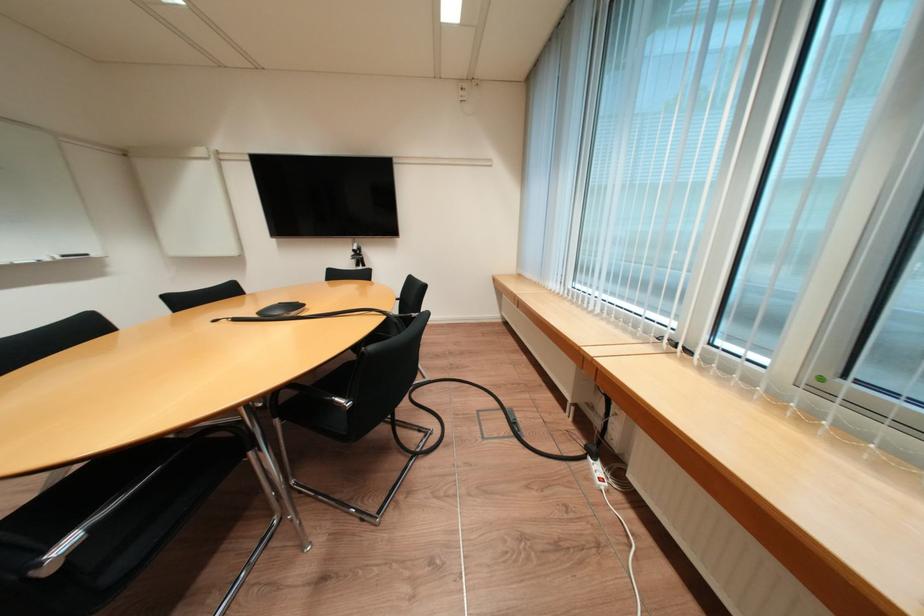
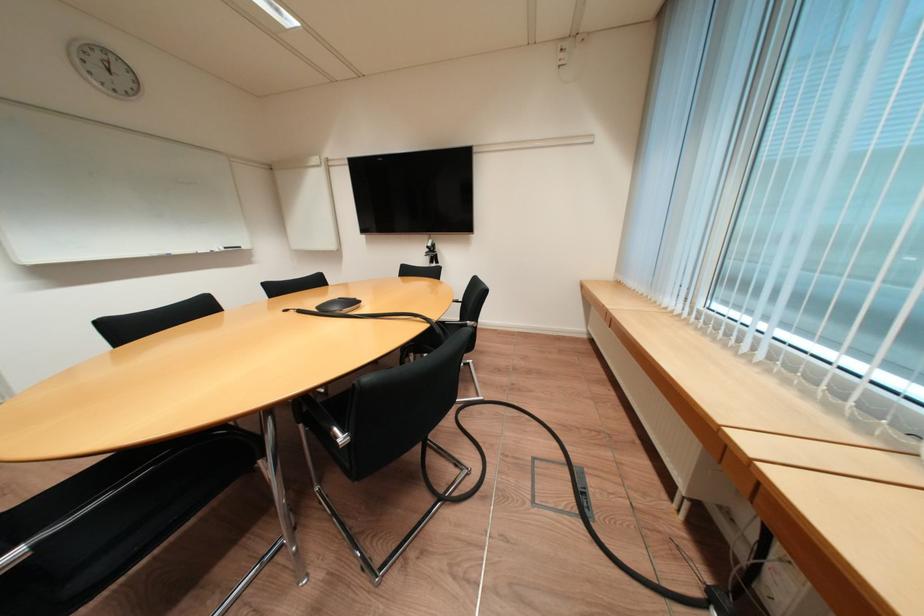
Question: What movement of the cameraman would produce the second image?

Choices:
 (A) Left
 (B) Right
 (C) Forward
 (D) Backward

Answer: (C)